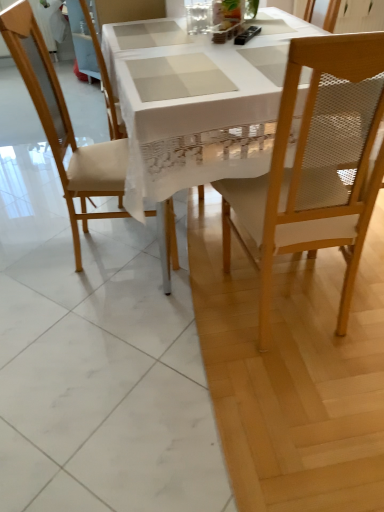
What are the coordinates of `vacant space that's between light wood mesh chair at right, which is the first chair in right-to-left order, and matte wood chair at left, which is the first chair from left to right` in the screenshot? It's located at (182, 278).